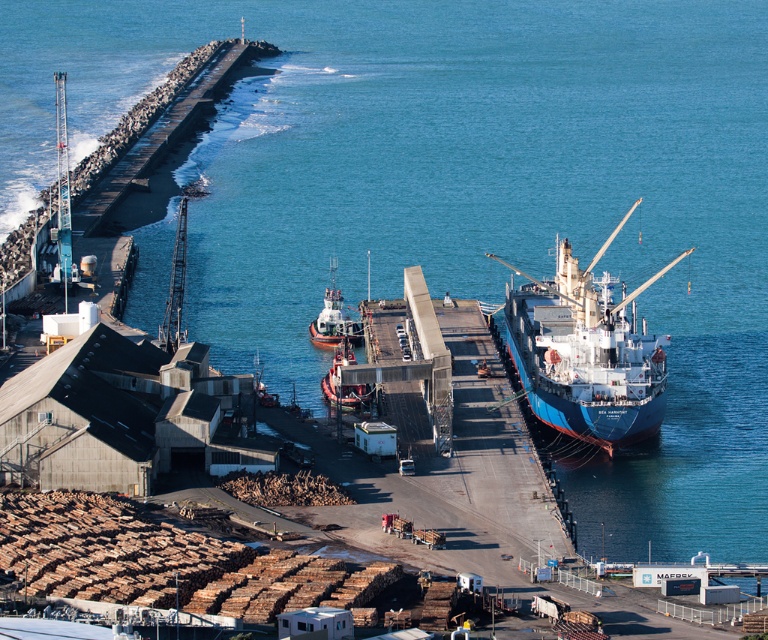
Question: Among these objects, which one is farthest from the camera?

Choices:
 (A) metallic gray tugboat at center
 (B) smooth white tugboat at center

Answer: (A)

Question: In this image, where is blue matte cargo ship at right located relative to metallic gray tugboat at center?

Choices:
 (A) right
 (B) left

Answer: (A)

Question: Is blue matte cargo ship at right to the left of smooth white tugboat at center from the viewer's perspective?

Choices:
 (A) no
 (B) yes

Answer: (A)

Question: Which point appears farthest from the camera in this image?

Choices:
 (A) (578, 317)
 (B) (353, 321)

Answer: (B)

Question: Is metallic gray tugboat at center positioned before smooth white tugboat at center?

Choices:
 (A) no
 (B) yes

Answer: (A)

Question: Which point appears farthest from the camera in this image?

Choices:
 (A) (330, 324)
 (B) (366, 397)
 (C) (603, 292)

Answer: (A)